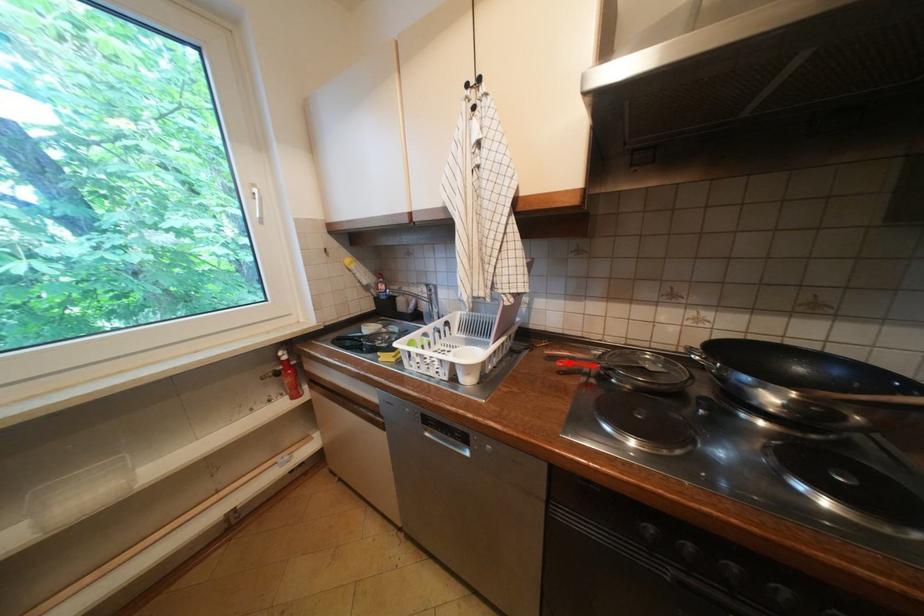
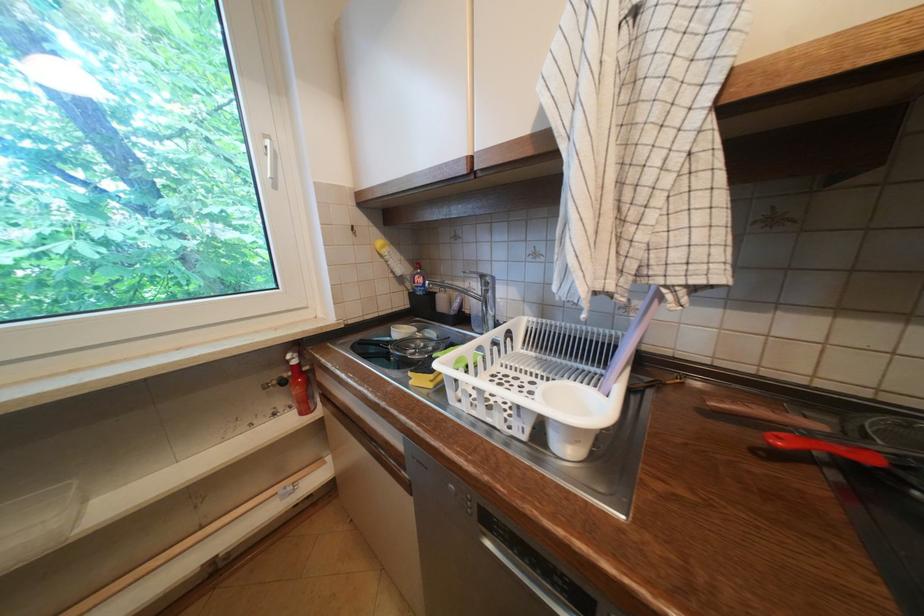
The point at the highlighted location is marked in the first image. Where is the corresponding point in the second image?

(788, 440)